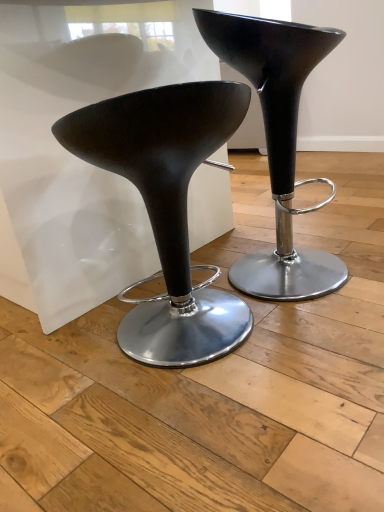
Question: Considering the relative positions of glossy black stool at center, the 1th stool from the right, and matte black stool at center, the second stool from the right, in the image provided, is glossy black stool at center, the 1th stool from the right, to the left of matte black stool at center, the second stool from the right, from the viewer's perspective?

Choices:
 (A) no
 (B) yes

Answer: (A)

Question: Is glossy black stool at center, the 1th stool from the right, outside of matte black stool at center, placed as the 1th stool when sorted from left to right?

Choices:
 (A) no
 (B) yes

Answer: (B)

Question: Does glossy black stool at center, the 1th stool from the right, have a smaller size compared to matte black stool at center, the second stool from the right?

Choices:
 (A) yes
 (B) no

Answer: (B)

Question: Is glossy black stool at center, the 1th stool from the right, turned away from matte black stool at center, placed as the 1th stool when sorted from left to right?

Choices:
 (A) no
 (B) yes

Answer: (A)

Question: Can you confirm if glossy black stool at center, the 1th stool from the right, is thinner than matte black stool at center, placed as the 1th stool when sorted from left to right?

Choices:
 (A) no
 (B) yes

Answer: (A)

Question: Is glossy black stool at center, arranged as the second stool when viewed from the left, taller than matte black stool at center, the second stool from the right?

Choices:
 (A) no
 (B) yes

Answer: (B)

Question: From a real-world perspective, is matte black stool at center, placed as the 1th stool when sorted from left to right, beneath glossy black stool at center, arranged as the second stool when viewed from the left?

Choices:
 (A) no
 (B) yes

Answer: (B)

Question: Is matte black stool at center, placed as the 1th stool when sorted from left to right, looking in the opposite direction of glossy black stool at center, arranged as the second stool when viewed from the left?

Choices:
 (A) no
 (B) yes

Answer: (A)

Question: Is matte black stool at center, the second stool from the right, oriented towards glossy black stool at center, arranged as the second stool when viewed from the left?

Choices:
 (A) yes
 (B) no

Answer: (B)

Question: Considering the relative sizes of matte black stool at center, the second stool from the right, and glossy black stool at center, arranged as the second stool when viewed from the left, in the image provided, is matte black stool at center, the second stool from the right, shorter than glossy black stool at center, arranged as the second stool when viewed from the left,?

Choices:
 (A) yes
 (B) no

Answer: (A)

Question: Is glossy black stool at center, the 1th stool from the right, located within matte black stool at center, placed as the 1th stool when sorted from left to right?

Choices:
 (A) yes
 (B) no

Answer: (B)

Question: Considering the relative sizes of matte black stool at center, the second stool from the right, and glossy black stool at center, the 1th stool from the right, in the image provided, is matte black stool at center, the second stool from the right, bigger than glossy black stool at center, the 1th stool from the right,?

Choices:
 (A) no
 (B) yes

Answer: (A)

Question: In the image, is glossy black stool at center, the 1th stool from the right, on the left side or the right side of matte black stool at center, the second stool from the right?

Choices:
 (A) left
 (B) right

Answer: (B)